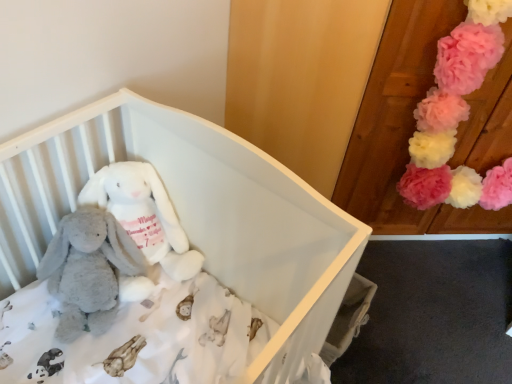
Question: From a real-world perspective, is soft plush bunny at center, placed as the 2th toy when sorted from left to right, physically located above or below fluffy pink pom-poms at upper right, placed as the first toy when sorted from right to left?

Choices:
 (A) above
 (B) below

Answer: (B)

Question: From the image's perspective, is soft plush bunny at center, which is the 2th toy from right to left, above or below fluffy pink pom-poms at upper right, placed as the first toy when sorted from right to left?

Choices:
 (A) above
 (B) below

Answer: (B)

Question: Which of these objects is positioned farthest from the soft plush bunny at center, which is the 2th toy from right to left?

Choices:
 (A) white plush infant bed at center
 (B) soft gray plush at center, the 1th toy in the left-to-right sequence
 (C) fluffy pink pom-poms at upper right, which is the third toy from left to right

Answer: (C)

Question: Which object is the closest to the soft plush bunny at center, placed as the 2th toy when sorted from left to right?

Choices:
 (A) fluffy pink pom-poms at upper right, placed as the first toy when sorted from right to left
 (B) white plush infant bed at center
 (C) soft gray plush at center, the 1th toy in the left-to-right sequence

Answer: (C)